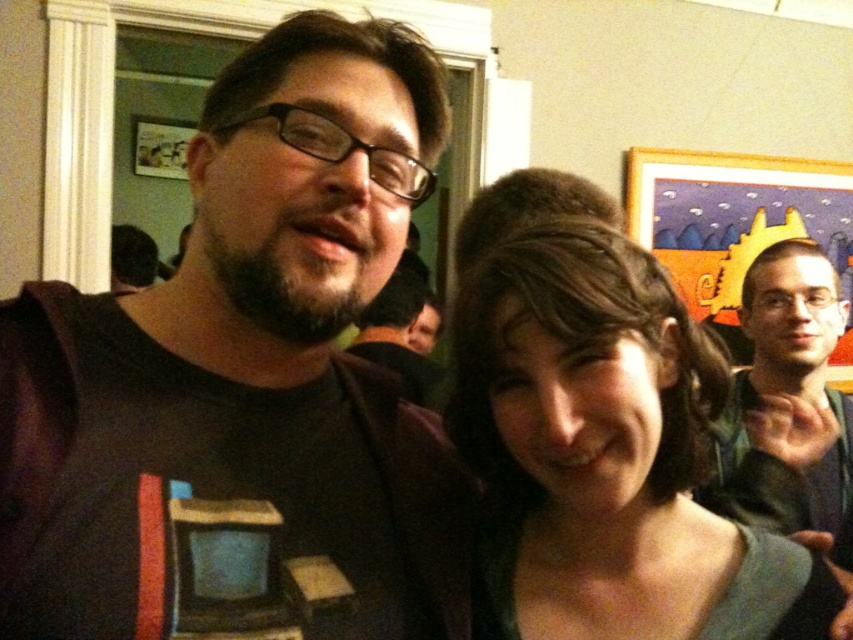
Who is shorter, dark brown t-shirt at left or matte black shirt at center?

matte black shirt at center is shorter.

This screenshot has width=853, height=640. Describe the element at coordinates (245, 362) in the screenshot. I see `dark brown t-shirt at left` at that location.

The width and height of the screenshot is (853, 640). What do you see at coordinates (245, 362) in the screenshot?
I see `dark brown t-shirt at left` at bounding box center [245, 362].

This screenshot has width=853, height=640. Identify the location of dark brown t-shirt at left. pyautogui.click(x=245, y=362).

Is smooth green dress at center shorter than green fabric shirt at right?

Yes, smooth green dress at center is shorter than green fabric shirt at right.

Who is positioned more to the right, smooth green dress at center or green fabric shirt at right?

green fabric shirt at right is more to the right.

Between point (642, 324) and point (753, 460), which one is positioned behind?

Point (753, 460)

Where is `smooth green dress at center`? The width and height of the screenshot is (853, 640). smooth green dress at center is located at coordinates tap(607, 454).

Which of these two, dark brown t-shirt at left or green fabric shirt at right, stands taller?

With more height is green fabric shirt at right.

Can you confirm if dark brown t-shirt at left is smaller than green fabric shirt at right?

Yes, dark brown t-shirt at left is smaller than green fabric shirt at right.

Between point (91, 518) and point (753, 339), which one is positioned behind?

The point (753, 339) is behind.

Image resolution: width=853 pixels, height=640 pixels. What are the coordinates of `dark brown t-shirt at left` in the screenshot? It's located at (245, 362).